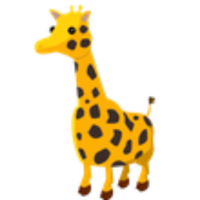
In order to click on toy giraffe in this screenshot , I will do `click(84, 78)`.